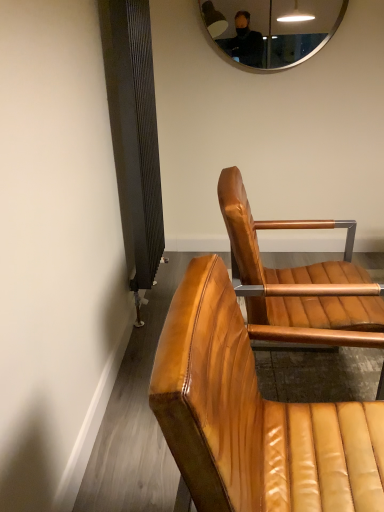
Question: Are shiny brown leather chair at center, marked as the second chair in a front-to-back arrangement, and leather chair at center, which is the second chair from back to front, located far from each other?

Choices:
 (A) no
 (B) yes

Answer: (A)

Question: Does shiny brown leather chair at center, the first chair when ordered from back to front, appear on the left side of leather chair at center, arranged as the first chair when viewed from the front?

Choices:
 (A) no
 (B) yes

Answer: (A)

Question: From the image's perspective, is shiny brown leather chair at center, marked as the second chair in a front-to-back arrangement, located above leather chair at center, arranged as the first chair when viewed from the front?

Choices:
 (A) yes
 (B) no

Answer: (A)

Question: Is shiny brown leather chair at center, marked as the second chair in a front-to-back arrangement, beside leather chair at center, which is the second chair from back to front?

Choices:
 (A) no
 (B) yes

Answer: (A)

Question: Considering the relative sizes of shiny brown leather chair at center, the first chair when ordered from back to front, and leather chair at center, which is the second chair from back to front, in the image provided, is shiny brown leather chair at center, the first chair when ordered from back to front, thinner than leather chair at center, which is the second chair from back to front,?

Choices:
 (A) no
 (B) yes

Answer: (A)

Question: In the image, is silver metallic mirror at upper center positioned in front of or behind leather chair at center, which is the second chair from back to front?

Choices:
 (A) behind
 (B) front

Answer: (A)

Question: Considering the positions of silver metallic mirror at upper center and leather chair at center, arranged as the first chair when viewed from the front, in the image, is silver metallic mirror at upper center taller or shorter than leather chair at center, arranged as the first chair when viewed from the front,?

Choices:
 (A) tall
 (B) short

Answer: (B)

Question: Is point (276, 50) positioned closer to the camera than point (200, 394)?

Choices:
 (A) farther
 (B) closer

Answer: (A)

Question: Is silver metallic mirror at upper center bigger or smaller than leather chair at center, arranged as the first chair when viewed from the front?

Choices:
 (A) small
 (B) big

Answer: (A)

Question: From a real-world perspective, is shiny brown leather chair at center, the first chair when ordered from back to front, above or below silver metallic mirror at upper center?

Choices:
 (A) above
 (B) below

Answer: (B)

Question: In terms of width, does shiny brown leather chair at center, marked as the second chair in a front-to-back arrangement, look wider or thinner when compared to silver metallic mirror at upper center?

Choices:
 (A) thin
 (B) wide

Answer: (B)

Question: In the image, is shiny brown leather chair at center, marked as the second chair in a front-to-back arrangement, positioned in front of or behind silver metallic mirror at upper center?

Choices:
 (A) behind
 (B) front

Answer: (B)

Question: Which is correct: shiny brown leather chair at center, the first chair when ordered from back to front, is inside silver metallic mirror at upper center, or outside of it?

Choices:
 (A) outside
 (B) inside

Answer: (A)

Question: From a real-world perspective, is leather chair at center, arranged as the first chair when viewed from the front, positioned above or below silver metallic mirror at upper center?

Choices:
 (A) below
 (B) above

Answer: (A)

Question: Looking at their shapes, would you say leather chair at center, which is the second chair from back to front, is wider or thinner than silver metallic mirror at upper center?

Choices:
 (A) thin
 (B) wide

Answer: (B)